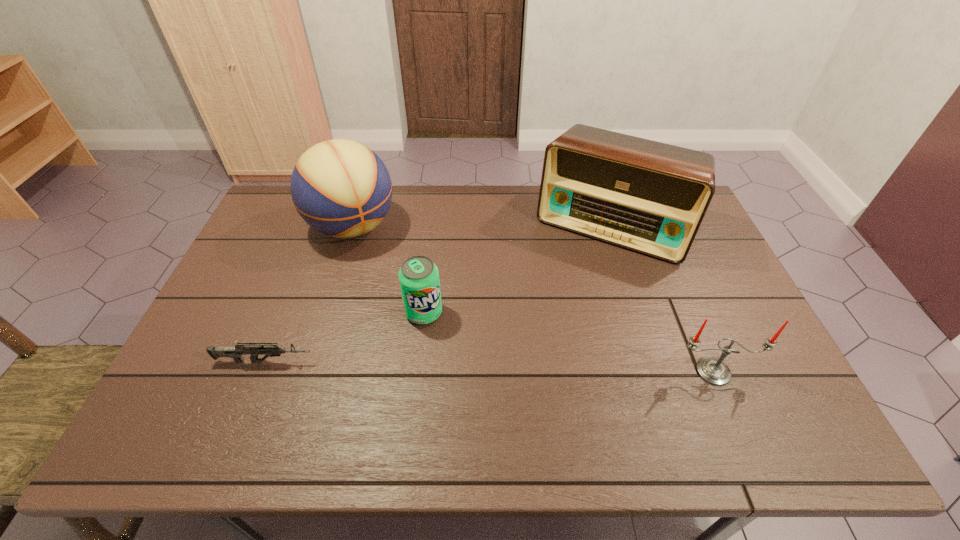
Locate an element on the screen. basketball located in the left edge section of the desktop is located at coordinates (341, 188).

Identify the location of candle positioned at the right edge. Image resolution: width=960 pixels, height=540 pixels. click(714, 371).

Identify the location of radio receiver that is positioned at the right edge. (650, 197).

Where is `object located at the far left corner`? The height and width of the screenshot is (540, 960). object located at the far left corner is located at coordinates (341, 188).

Identify the location of object at the far right corner. (650, 197).

Identify the location of object situated at the near right corner. (714, 371).

Where is `vacant space at the far edge`? The height and width of the screenshot is (540, 960). vacant space at the far edge is located at coordinates (504, 191).

Locate an element on the screen. The image size is (960, 540). vacant space at the near edge is located at coordinates (249, 400).

This screenshot has width=960, height=540. What are the coordinates of `free space at the left edge of the desktop` in the screenshot? It's located at (260, 231).

Find the location of `vacant space at the right edge of the desktop`. vacant space at the right edge of the desktop is located at coordinates (708, 256).